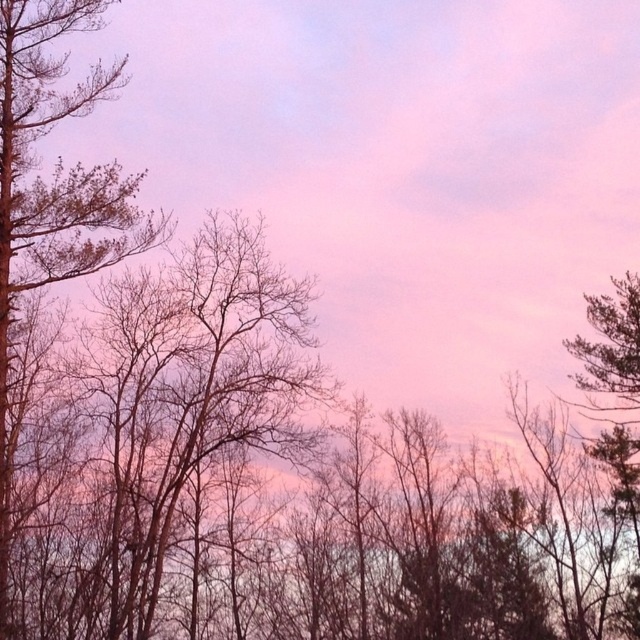
Question: Which object is closer to the camera taking this photo?

Choices:
 (A) bare branches at left
 (B) dark green textured tree at right

Answer: (A)

Question: Which point is closer to the camera?

Choices:
 (A) (630, 522)
 (B) (136, 182)

Answer: (B)

Question: Does bare branches at left have a greater width compared to dark green textured tree at right?

Choices:
 (A) yes
 (B) no

Answer: (B)

Question: Is bare branches at left to the right of dark green textured tree at right from the viewer's perspective?

Choices:
 (A) no
 (B) yes

Answer: (A)

Question: Is bare branches at left thinner than dark green textured tree at right?

Choices:
 (A) no
 (B) yes

Answer: (B)